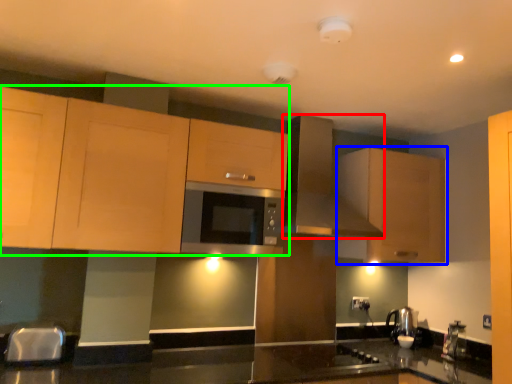
Question: Based on their relative distances, which object is nearer to kitchen appliance (highlighted by a red box)? Choose from cabinetry (highlighted by a blue box) and cabinetry (highlighted by a green box).

Choices:
 (A) cabinetry
 (B) cabinetry

Answer: (A)